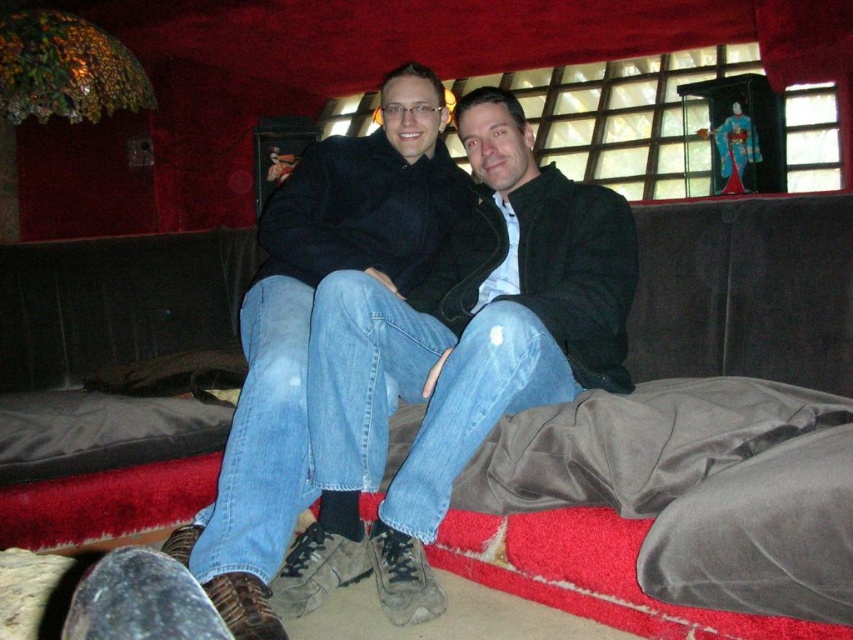
You are designing a living room layout and need to place a 3D model of the velvet dark brown couch at center and the jeans at center. According to the image, which object should be placed first if you want to prioritize fitting the wider item into the space?

The jeans at center should be placed first since they are wider than the velvet dark brown couch at center, ensuring there is enough space for them in the layout.